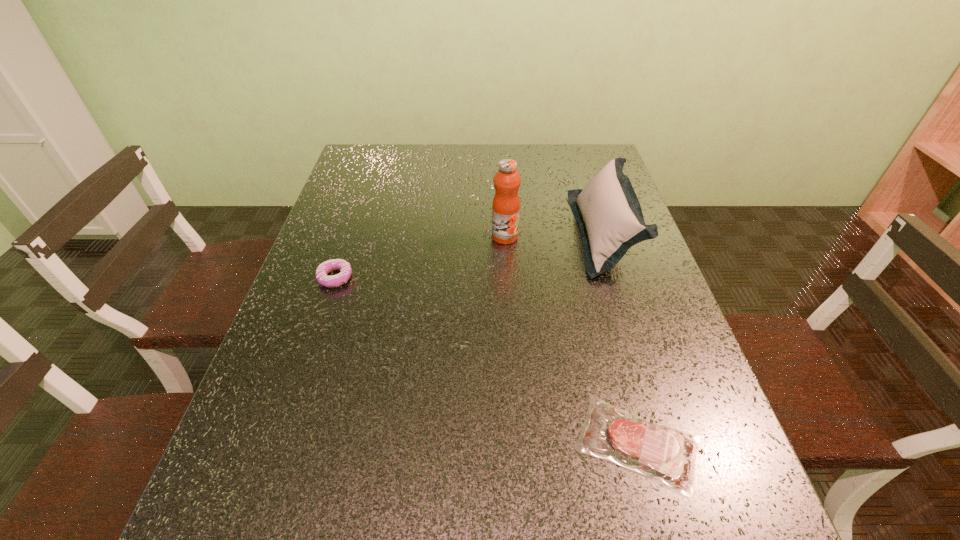
What are the coordinates of `the tallest object` in the screenshot? It's located at (506, 205).

The image size is (960, 540). I want to click on the second object from left to right, so click(x=506, y=205).

Where is `the second tallest object`? This screenshot has height=540, width=960. the second tallest object is located at coordinates (610, 218).

The height and width of the screenshot is (540, 960). I want to click on the second shortest object, so click(x=326, y=267).

Locate an element on the screen. Image resolution: width=960 pixels, height=540 pixels. the leftmost object is located at coordinates (326, 267).

Locate an element on the screen. The width and height of the screenshot is (960, 540). the shortest object is located at coordinates (662, 453).

The image size is (960, 540). What are the coordinates of `steak` in the screenshot? It's located at (662, 453).

This screenshot has height=540, width=960. I want to click on free space located on the front label of the fruit juice, so click(x=507, y=266).

Identify the location of vacant space situated 0.290m on the surface of the cushion. (468, 233).

The height and width of the screenshot is (540, 960). I want to click on vacant space situated on the surface of the cushion, so click(505, 233).